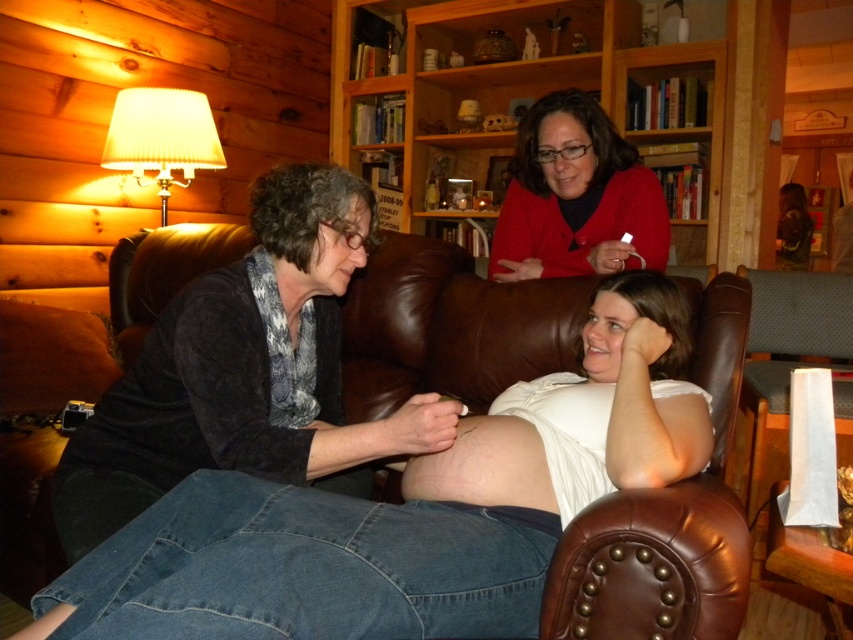
You are a photographer taking a portrait in this living room. You notice the dark gray sweater at center and the smooth skin belly at center. Which object is positioned to the right side of the other?

The dark gray sweater at center is to the left of smooth skin belly at center, so the smooth skin belly at center is positioned to the right side of the dark gray sweater at center.

In the scene shown: You are standing in the living room and want to place a small plant between the two points marked as point (432, 401) and point (491, 429). Which point should the plant be closer to in order to be nearer to the viewer?

The plant should be placed closer to point (432, 401) because it is nearer to the viewer compared to point (491, 429).

Based on the photo, you are a photographer setting up for a portrait in this scene. You notice the dark gray sweater at center and the smooth skin belly at center. Which object is covering the other?

The dark gray sweater at center is positioned over the smooth skin belly at center, so it is covering it.